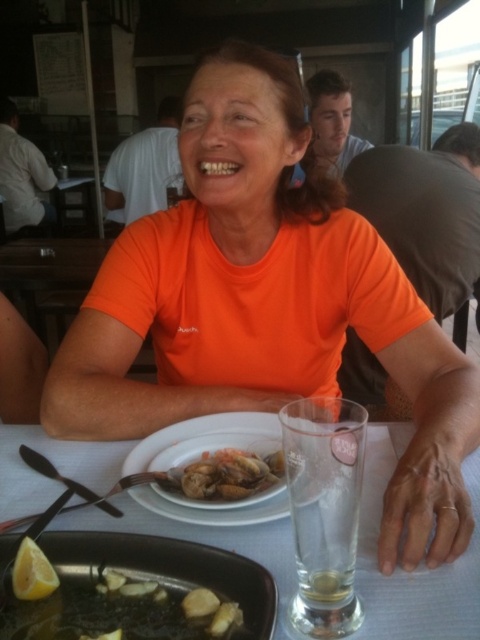
Between shiny silver pan at lower left and shiny brown clams at center, which one has less height?

Standing shorter between the two is shiny brown clams at center.

The width and height of the screenshot is (480, 640). In order to click on shiny silver pan at lower left in this screenshot , I will do `click(115, 602)`.

At what (x,y) coordinates should I click in order to perform the action: click on shiny silver pan at lower left. Please return your answer as a coordinate pair (x, y). The image size is (480, 640). Looking at the image, I should click on (115, 602).

Is point (131, 627) closer to camera compared to point (273, 486)?

Yes, point (131, 627) is in front of point (273, 486).

Is the position of shiny silver pan at lower left less distant than that of white matte plate at center?

Yes.

Does point (232, 602) come farther from viewer compared to point (217, 516)?

That is False.

Find the location of a particular element. The width and height of the screenshot is (480, 640). shiny silver pan at lower left is located at coordinates (115, 602).

Is white glossy plate at center taller than white matte plate at center?

Yes, white glossy plate at center is taller than white matte plate at center.

Consider the image. Does white glossy plate at center have a lesser width compared to white matte plate at center?

No, white glossy plate at center is not thinner than white matte plate at center.

Is point (406, 440) positioned behind point (262, 416)?

No.

Image resolution: width=480 pixels, height=640 pixels. In order to click on white glossy plate at center in this screenshot , I will do `click(418, 566)`.